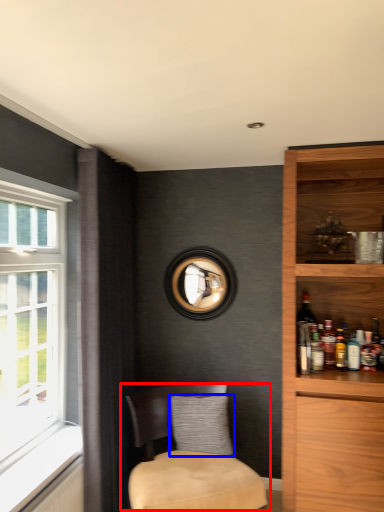
Question: Which of the following is the farthest to the observer, chair (highlighted by a red box) or pillow (highlighted by a blue box)?

Choices:
 (A) chair
 (B) pillow

Answer: (B)